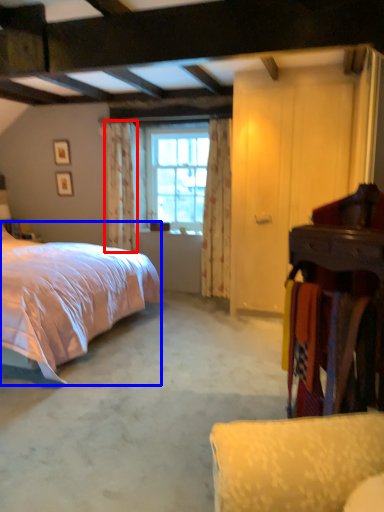
Question: Which point is further to the camera, curtain (highlighted by a red box) or bed (highlighted by a blue box)?

Choices:
 (A) curtain
 (B) bed

Answer: (A)